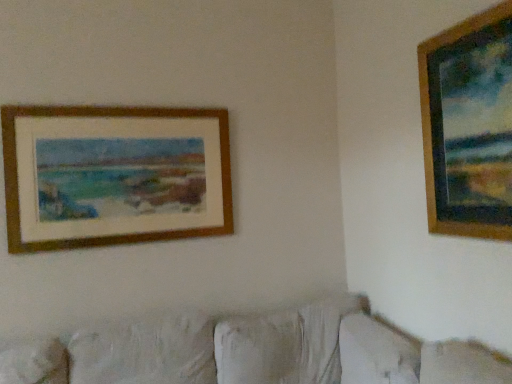
Question: In terms of width, does white fabric couch at lower center look wider or thinner when compared to wooden frame at upper right, which is the 1th picture frame in right-to-left order?

Choices:
 (A) thin
 (B) wide

Answer: (B)

Question: From the image's perspective, is white fabric couch at lower center above or below wooden frame at upper right, placed as the second picture frame when sorted from left to right?

Choices:
 (A) below
 (B) above

Answer: (A)

Question: Which of these objects is positioned farthest from the wooden frame at upper left, the first picture frame from the left?

Choices:
 (A) wooden frame at upper right, acting as the 1th picture frame starting from the front
 (B) white fabric couch at lower center

Answer: (A)

Question: Which object is positioned farthest from the white fabric couch at lower center?

Choices:
 (A) wooden frame at upper right, acting as the 1th picture frame starting from the front
 (B) wooden frame at upper left, which appears as the second picture frame when viewed from the front

Answer: (A)